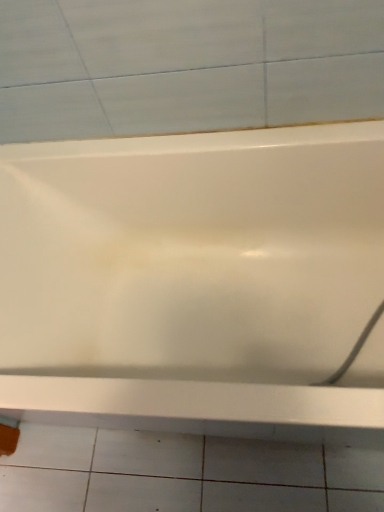
Question: Is white glossy bathtub at center inside the boundaries of white glossy ceramic tile at lower center, or outside?

Choices:
 (A) inside
 (B) outside

Answer: (B)

Question: Is point (203, 429) closer or farther from the camera than point (339, 482)?

Choices:
 (A) closer
 (B) farther

Answer: (B)

Question: In terms of height, does white glossy bathtub at center look taller or shorter compared to white glossy ceramic tile at lower center?

Choices:
 (A) tall
 (B) short

Answer: (A)

Question: Is point (18, 477) positioned closer to the camera than point (59, 280)?

Choices:
 (A) closer
 (B) farther

Answer: (B)

Question: Based on their positions, is white glossy ceramic tile at lower center located to the left or right of white glossy bathtub at center?

Choices:
 (A) right
 (B) left

Answer: (B)

Question: From their relative heights in the image, would you say white glossy ceramic tile at lower center is taller or shorter than white glossy bathtub at center?

Choices:
 (A) short
 (B) tall

Answer: (A)

Question: Considering the positions of white glossy ceramic tile at lower center and white glossy bathtub at center in the image, is white glossy ceramic tile at lower center bigger or smaller than white glossy bathtub at center?

Choices:
 (A) big
 (B) small

Answer: (B)